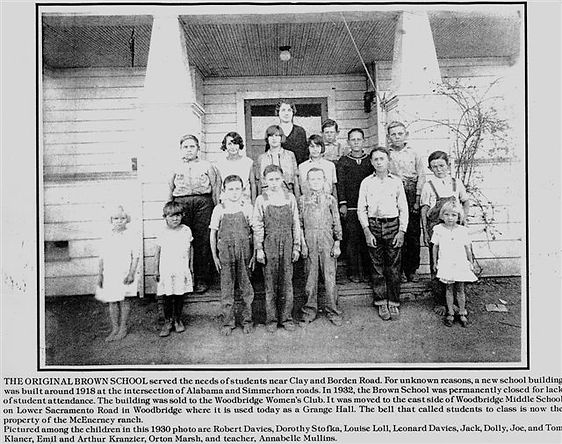
Image resolution: width=562 pixels, height=444 pixels. Find the location of `door`. door is located at coordinates (305, 119).